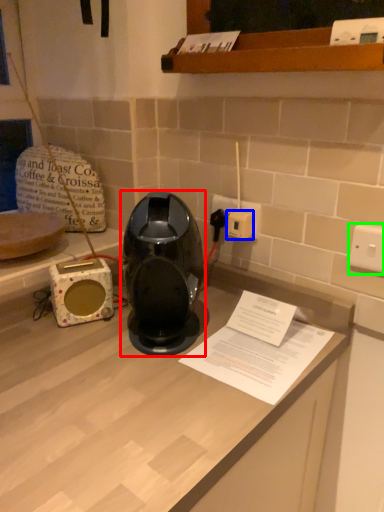
Question: Estimate the real-world distances between objects in this image. Which object is closer to home appliance (highlighted by a red box), socket (highlighted by a blue box) or electric outlet (highlighted by a green box)?

Choices:
 (A) socket
 (B) electric outlet

Answer: (A)